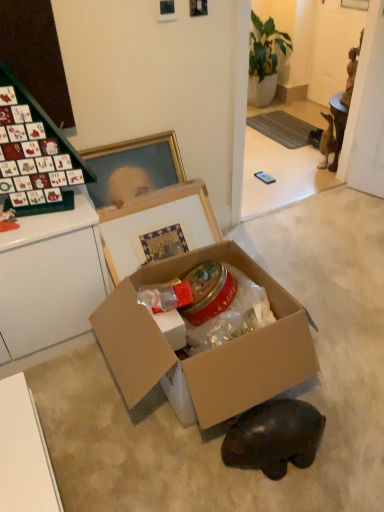
What are the coordinates of `vacant space to the right of cardboard box at center` in the screenshot? It's located at (344, 345).